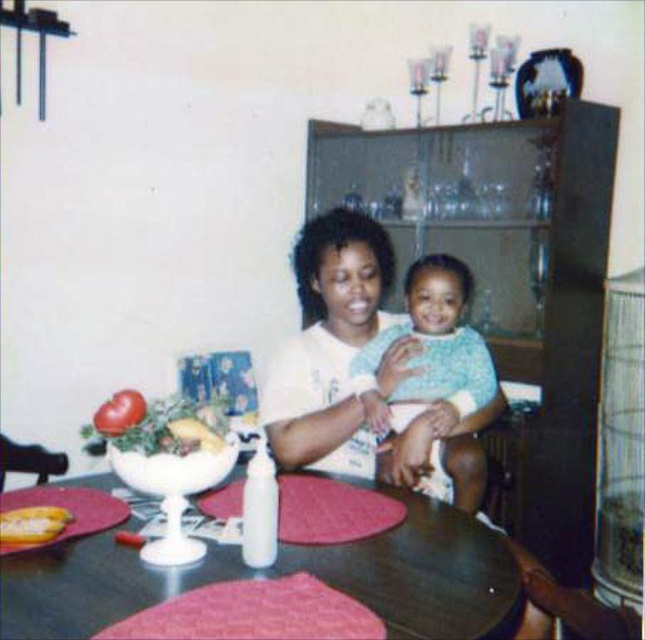
Question: Which of these objects is positioned closest to the light blue knit sweater at center?

Choices:
 (A) smooth red tomato at left
 (B) dark wood table at center
 (C) white matte shirt at center
 (D) yellow matte banana at lower left

Answer: (C)

Question: Is the position of light blue knit sweater at center more distant than that of smooth red tomato at left?

Choices:
 (A) yes
 (B) no

Answer: (A)

Question: Which object appears closest to the camera in this image?

Choices:
 (A) light blue knit sweater at center
 (B) yellow matte banana at lower left
 (C) white matte shirt at center

Answer: (B)

Question: Which point is closer to the camera?

Choices:
 (A) (366, 378)
 (B) (399, 477)
 (C) (54, 520)

Answer: (C)

Question: Where is dark wood table at center located in relation to light blue knit sweater at center in the image?

Choices:
 (A) above
 (B) below

Answer: (B)

Question: In this image, where is dark wood table at center located relative to white matte shirt at center?

Choices:
 (A) left
 (B) right

Answer: (A)